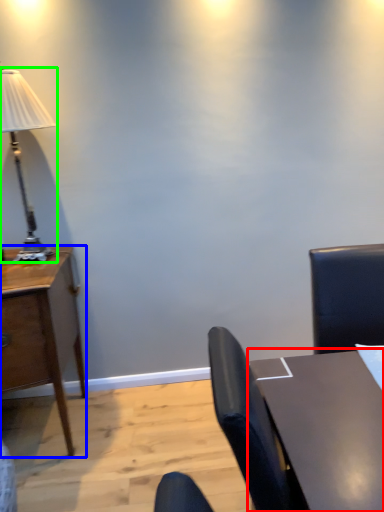
Question: Which object is the farthest from table (highlighted by a red box)? Choose among these: desk (highlighted by a blue box) or lamp (highlighted by a green box).

Choices:
 (A) desk
 (B) lamp

Answer: (B)